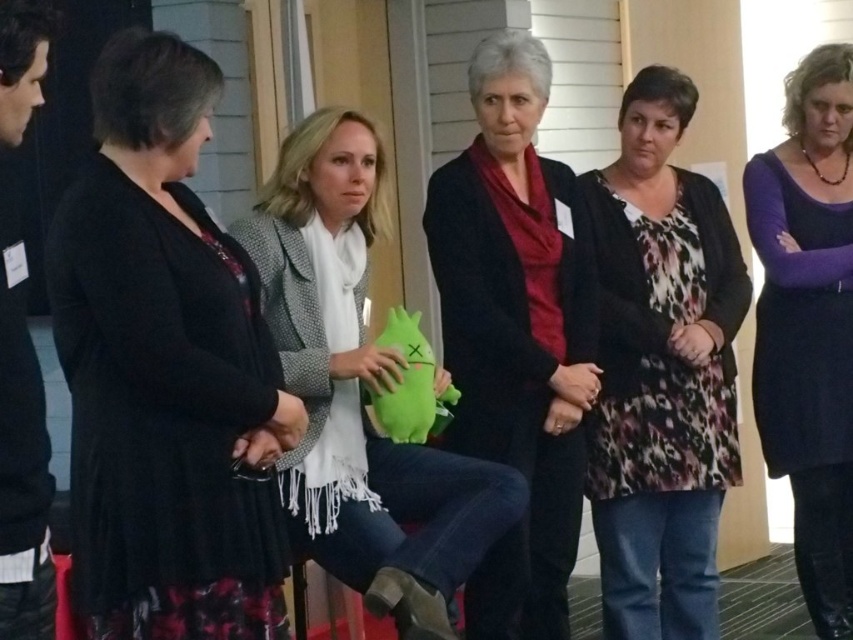
Is floral print sweater at center below purple matte dress at center?

Indeed, floral print sweater at center is positioned under purple matte dress at center.

Which of these two, floral print sweater at center or purple matte dress at center, stands taller?

Standing taller between the two is purple matte dress at center.

Which is behind, point (724, 314) or point (828, 112)?

Positioned behind is point (828, 112).

Locate an element on the screen. The image size is (853, 640). floral print sweater at center is located at coordinates (660, 371).

Is black matte skirt at left in front of matte black jacket at center?

Yes.

Is point (107, 472) farther from camera compared to point (520, 548)?

No, (107, 472) is in front of (520, 548).

Identify the location of black matte skirt at left. (165, 371).

Find the location of a particular element. This screenshot has height=640, width=853. floral print sweater at center is located at coordinates (660, 371).

Locate an element on the screen. floral print sweater at center is located at coordinates (660, 371).